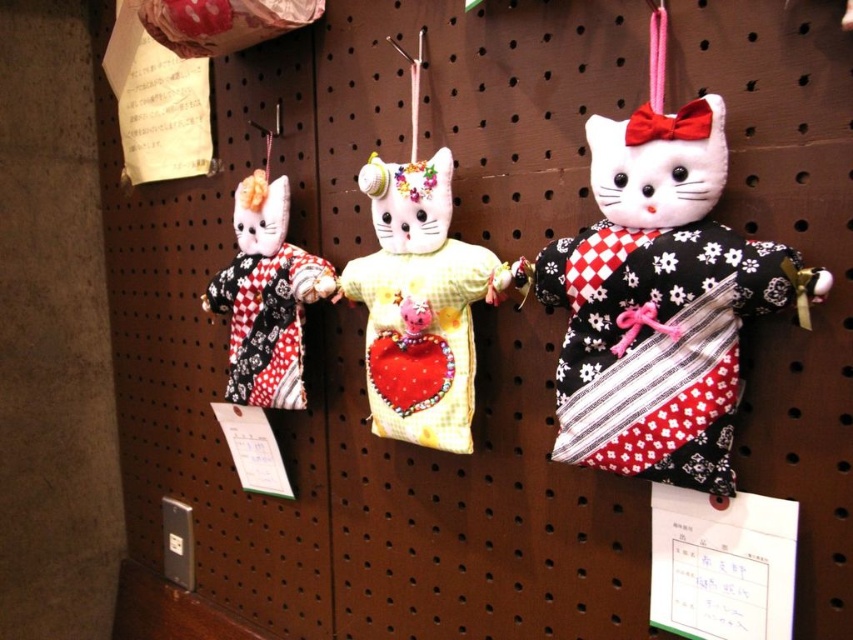
Who is higher up, matte black kimono at right or yellow fabric cat at center?

matte black kimono at right is above.

Between matte black kimono at right and yellow fabric cat at center, which one appears on the left side from the viewer's perspective?

yellow fabric cat at center is more to the left.

Is point (606, 314) farther from viewer compared to point (480, 278)?

No, it is not.

Locate an element on the screen. The image size is (853, 640). matte black kimono at right is located at coordinates (659, 301).

Is yellow fabric cat at center behind matte black and white kimono cat at left?

No, yellow fabric cat at center is in front of matte black and white kimono cat at left.

Is yellow fabric cat at center to the left of matte black and white kimono cat at left from the viewer's perspective?

No, yellow fabric cat at center is not to the left of matte black and white kimono cat at left.

Does point (469, 397) come in front of point (238, 321)?

Yes.

I want to click on yellow fabric cat at center, so click(x=419, y=305).

Can you confirm if matte black kimono at right is positioned to the left of matte black and white kimono cat at left?

In fact, matte black kimono at right is to the right of matte black and white kimono cat at left.

Is the position of matte black kimono at right more distant than that of matte black and white kimono cat at left?

That is False.

Measure the distance between matte black kimono at right and camera.

The distance of matte black kimono at right from camera is 76.16 centimeters.

Locate an element on the screen. matte black kimono at right is located at coordinates (659, 301).